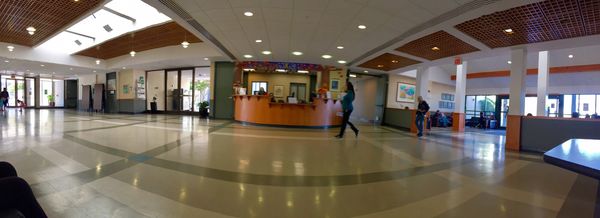
At what (x,y) coordinates should I click in order to perform the action: click on grid patterned floor. Please return your answer as a coordinate pair (x, y). Looking at the image, I should click on (138, 154), (432, 169).